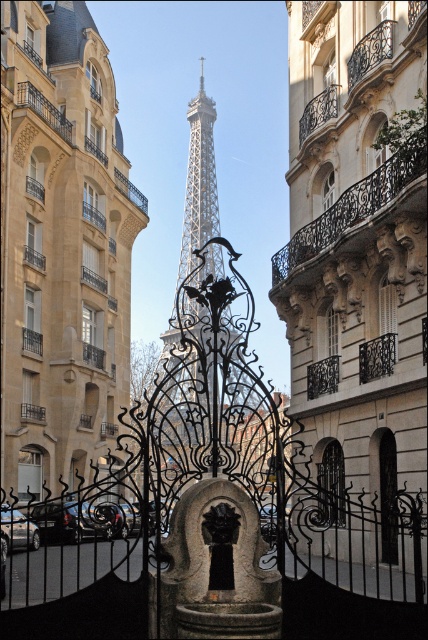
You are a tourist standing in front of the black wrought iron gate at center, looking towards the smooth stone tower at center. Which object is taller?

The smooth stone tower at center is taller than the black wrought iron gate at center.

You are a tourist standing in front of the ornate wrought iron gates in the scene. You want to take a photo that includes both the smooth stone tower at center and the white metallic eiffel tower at center. Which tower should you position closer to the foreground to ensure both are visible in the frame?

To ensure both the smooth stone tower at center and the white metallic eiffel tower at center are visible in the frame, position the smooth stone tower at center closer to the foreground since it is shorter than the white metallic eiffel tower at center.

You are standing in front of the ornate wrought iron gates in the urban scene. There is a point marked at coordinates (62, 244). What does this point indicate?

The point at coordinates (62, 244) marks the location of the smooth stone tower at center.